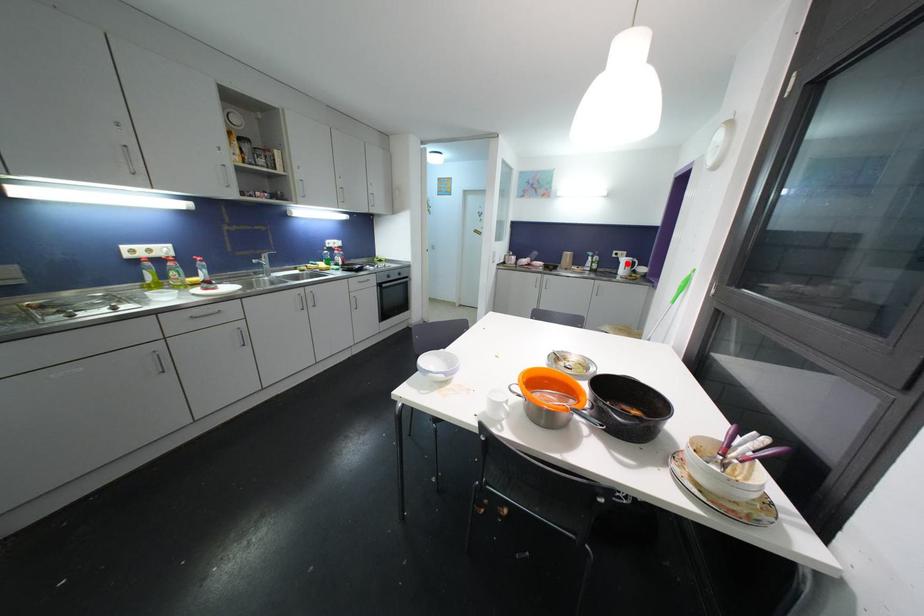
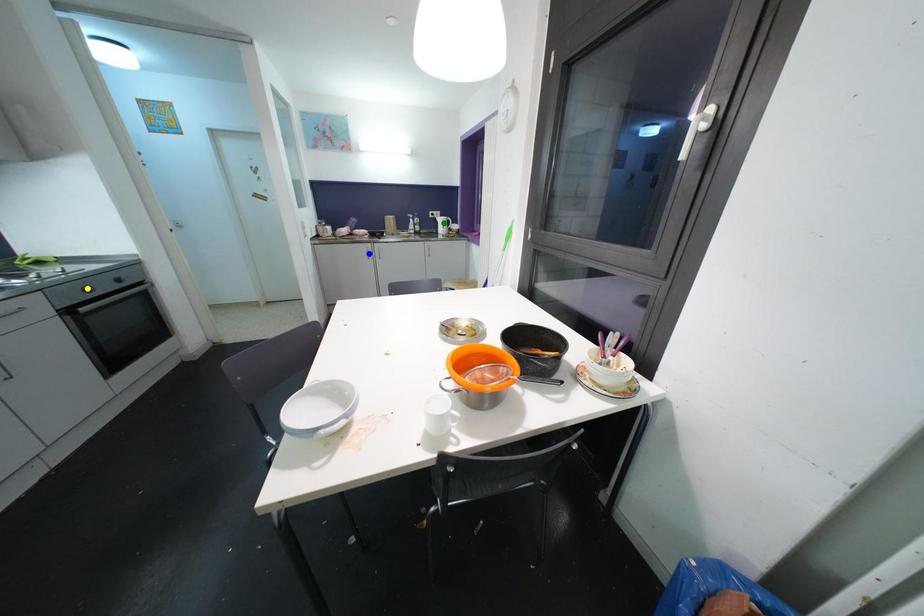
Question: I am providing you with two images of the same scene from different viewpoints. A red point is marked on the first image. You are given multiple points on the second image. Which mark in image 2 goes with the point in image 1?

Choices:
 (A) green point
 (B) blue point
 (C) yellow point

Answer: (A)